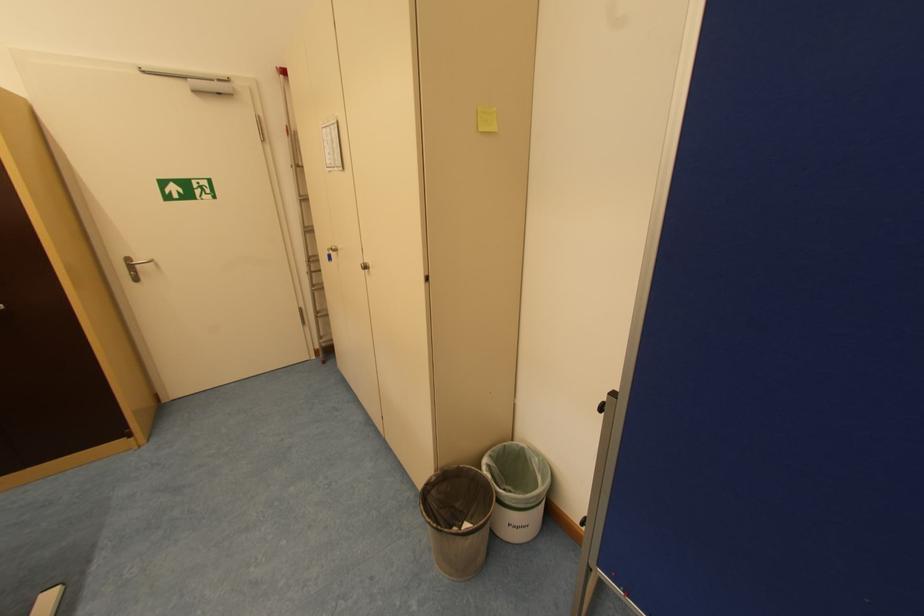
The location [485,119] corresponds to which object?

This point indicates the yellow sticky note.